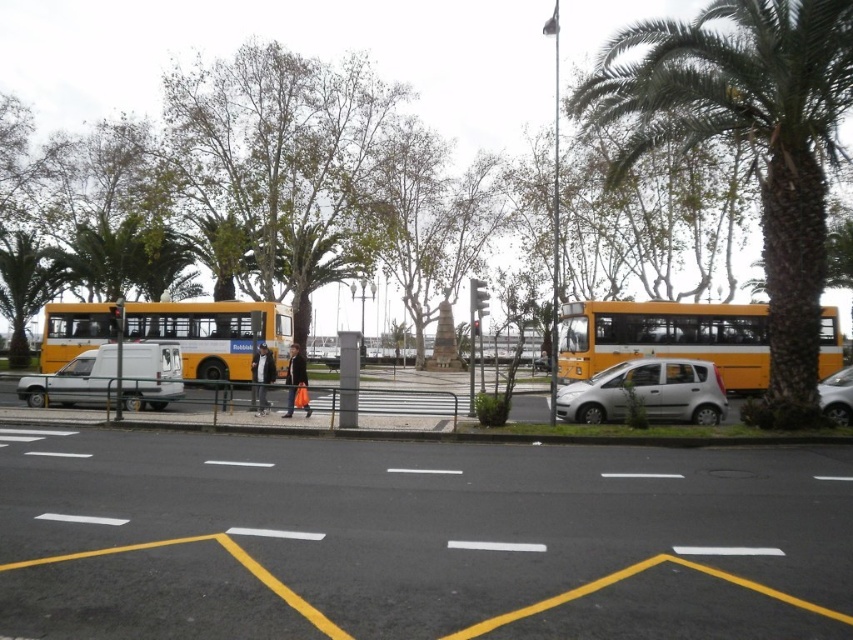
You are a delivery driver needing to park your truck, which is 10 feet long, in a spot between the yellow matte bus at left and the silver metallic sedan at right. The space between them is exactly 12 feet. Can your truck fit there?

The space between the yellow matte bus at left and the silver metallic sedan at right is 12 feet. Since your truck is 10 feet long, it can fit in the available space.

You are a delivery driver who needs to park your vehicle in the yellow asphalt parking lot at center. However, there is a green leafy palm tree at right. Will the tree obstruct your parking space?

The yellow asphalt parking lot at center is positioned under the green leafy palm tree at right, so the tree will likely cast a shadow over the parking space but won

You are standing at the point with coordinates point (76, 308) and want to take a photo of the entire street scene. If your camera has a maximum range of 100 feet, will you be able to capture the entire scene in one shot?

The point (76, 308) and camera are 99.76 feet apart from each other. Since the distance is less than 100 feet, the camera can capture the entire scene in one shot.